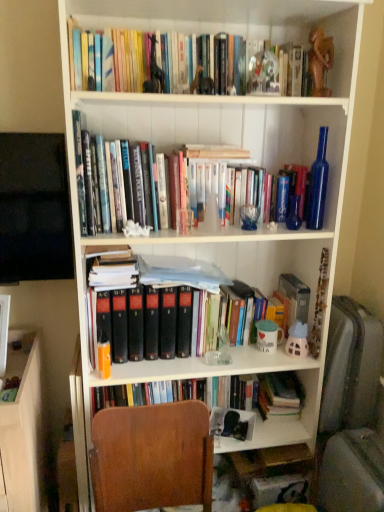
I want to click on brown wood chair at lower center, so click(152, 457).

Find the location of a particular element. The width and height of the screenshot is (384, 512). hardcover book at center is located at coordinates (295, 298).

Measure the distance between hardcover book at center and camera.

hardcover book at center is 1.74 meters away from camera.

What is the approximate height of white glossy mug at middle right?

5.28 inches.

The width and height of the screenshot is (384, 512). What do you see at coordinates (268, 335) in the screenshot?
I see `white glossy mug at middle right` at bounding box center [268, 335].

Identify the location of brown wood chair at lower center. (152, 457).

From the image's perspective, which is above, hardcover books at lower center, arranged as the first book when viewed from the back, or hardcover book at center?

hardcover book at center is shown above in the image.

Based on their positions, is hardcover books at lower center, arranged as the 2th book when viewed from the front, located to the left or right of hardcover book at center?

From the image, it's evident that hardcover books at lower center, arranged as the 2th book when viewed from the front, is to the left of hardcover book at center.

Can you see hardcover books at lower center, the 1th book when ordered from bottom to top, touching hardcover book at center?

No, hardcover books at lower center, the 1th book when ordered from bottom to top, is not with hardcover book at center.

At what (x,y) coordinates should I click in order to perform the action: click on chair in front of the hardcover books at upper center, acting as the first book starting from the front. Please return your answer as a coordinate pair (x, y). Image resolution: width=384 pixels, height=512 pixels. Looking at the image, I should click on (152, 457).

Consider the image. From a real-world perspective, between brown wood chair at lower center and hardcover books at upper center, placed as the first book when sorted from top to bottom, who is vertically higher?

In real-world perspective, hardcover books at upper center, placed as the first book when sorted from top to bottom, is above.

Would you say brown wood chair at lower center is outside hardcover books at upper center, acting as the first book starting from the front?

Indeed, brown wood chair at lower center is completely outside hardcover books at upper center, acting as the first book starting from the front.

Looking at this image, is hardcover books at upper center, placed as the first book when sorted from top to bottom, oriented towards hardcover book at center?

No.

Is hardcover books at upper center, which is counted as the 2th book, starting from the bottom, to the right of hardcover book at center from the viewer's perspective?

Incorrect, hardcover books at upper center, which is counted as the 2th book, starting from the bottom, is not on the right side of hardcover book at center.

From a real-world perspective, is hardcover books at upper center, which is counted as the 2th book, starting from the bottom, under hardcover book at center?

No, from a real-world perspective, hardcover books at upper center, which is counted as the 2th book, starting from the bottom, is not below hardcover book at center.

Relative to hardcover book at center, is hardcover books at upper center, acting as the first book starting from the front, in front or behind?

hardcover books at upper center, acting as the first book starting from the front, is in front of hardcover book at center.

Between white glossy mug at middle right and hardcover book at center, which one is positioned in front?

white glossy mug at middle right is in front.

Where is `coffee cup that is below the hardcover book at center (from the image's perspective)`? This screenshot has width=384, height=512. coffee cup that is below the hardcover book at center (from the image's perspective) is located at coordinates (268, 335).

Would you say white glossy mug at middle right is inside or outside hardcover book at center?

white glossy mug at middle right is not inside hardcover book at center, it's outside.

Can you see white glossy mug at middle right touching hardcover book at center?

white glossy mug at middle right is not next to hardcover book at center, and they're not touching.

From a real-world perspective, is hardcover book at center physically below hardcover books at upper center, which ranks as the 2th book in back-to-front order?

Yes.

Is hardcover book at center bigger than hardcover books at upper center, placed as the first book when sorted from top to bottom?

Incorrect, hardcover book at center is not larger than hardcover books at upper center, placed as the first book when sorted from top to bottom.

From the image's perspective, which is below, hardcover book at center or hardcover books at upper center, acting as the first book starting from the front?

hardcover book at center appears lower in the image.

From the image's perspective, is hardcover books at lower center, the 1th book when ordered from bottom to top, below hardcover books at upper center, acting as the first book starting from the front?

Yes.

Between hardcover books at lower center, arranged as the first book when viewed from the back, and hardcover books at upper center, which is counted as the 2th book, starting from the bottom, which one has more height?

With more height is hardcover books at lower center, arranged as the first book when viewed from the back.

This screenshot has width=384, height=512. Find the location of `book beneath the hardcover books at upper center, which ranks as the 2th book in back-to-front order (from a real-world perspective)`. book beneath the hardcover books at upper center, which ranks as the 2th book in back-to-front order (from a real-world perspective) is located at coordinates (279, 395).

Which object is positioned more to the right, hardcover books at lower center, arranged as the first book when viewed from the back, or hardcover books at upper center, acting as the first book starting from the front?

hardcover books at lower center, arranged as the first book when viewed from the back, is more to the right.

Is hardcover books at upper center, acting as the first book starting from the front, oriented towards hardcover books at lower center, arranged as the first book when viewed from the back?

No, hardcover books at upper center, acting as the first book starting from the front, is not facing towards hardcover books at lower center, arranged as the first book when viewed from the back.

From a real-world perspective, is hardcover books at upper center, which is counted as the 2th book, starting from the bottom, positioned above or below hardcover books at lower center, the 2th book when ordered from top to bottom?

From a real-world perspective, hardcover books at upper center, which is counted as the 2th book, starting from the bottom, is physically above hardcover books at lower center, the 2th book when ordered from top to bottom.

From their relative heights in the image, would you say hardcover books at upper center, which ranks as the 2th book in back-to-front order, is taller or shorter than hardcover books at lower center, the 2th book when ordered from top to bottom?

In the image, hardcover books at upper center, which ranks as the 2th book in back-to-front order, appears to be shorter than hardcover books at lower center, the 2th book when ordered from top to bottom.

Consider the image. Who is bigger, hardcover books at upper center, which ranks as the 2th book in back-to-front order, or hardcover books at lower center, the 1th book when ordered from bottom to top?

hardcover books at upper center, which ranks as the 2th book in back-to-front order, is bigger.

Locate an element on the screen. book behind the hardcover book at center is located at coordinates (279, 395).

Starting from the brown wood chair at lower center, which book is the 1st one to the right? Please provide its 2D coordinates.

[(155, 61)]

Estimate the real-world distances between objects in this image. Which object is further from hardcover books at upper center, which ranks as the 2th book in back-to-front order, hardcover book at center or hardcover books at lower center, arranged as the first book when viewed from the back?

Among the two, hardcover books at lower center, arranged as the first book when viewed from the back, is located further to hardcover books at upper center, which ranks as the 2th book in back-to-front order.

From the picture: Based on their spatial positions, is brown wood chair at lower center or hardcover book at center further from white glossy mug at middle right?

brown wood chair at lower center is positioned further to the anchor white glossy mug at middle right.

Which object lies nearer to the anchor point hardcover books at lower center, arranged as the first book when viewed from the back, white glossy mug at middle right or brown wood chair at lower center?

Based on the image, white glossy mug at middle right appears to be nearer to hardcover books at lower center, arranged as the first book when viewed from the back.

Looking at the image, which one is located closer to hardcover books at upper center, placed as the first book when sorted from top to bottom, hardcover books at lower center, the 2th book when ordered from top to bottom, or brown wood chair at lower center?

brown wood chair at lower center is positioned closer to the anchor hardcover books at upper center, placed as the first book when sorted from top to bottom.

Looking at the image, which one is located closer to hardcover books at lower center, the 2th book when ordered from top to bottom, brown wood chair at lower center or white glossy mug at middle right?

white glossy mug at middle right.

From the image, which object appears to be farther from hardcover book at center, brown wood chair at lower center or hardcover books at lower center, arranged as the 2th book when viewed from the front?

Based on the image, brown wood chair at lower center appears to be further to hardcover book at center.

Based on the photo, based on their spatial positions, is white glossy mug at middle right or hardcover books at upper center, which ranks as the 2th book in back-to-front order, further from brown wood chair at lower center?

Among the two, hardcover books at upper center, which ranks as the 2th book in back-to-front order, is located further to brown wood chair at lower center.

Looking at this image, looking at the image, which one is located further to hardcover books at lower center, arranged as the 2th book when viewed from the front, hardcover book at center or brown wood chair at lower center?

brown wood chair at lower center.

The image size is (384, 512). I want to click on coffee cup between hardcover book at center and hardcover books at lower center, the 1th book when ordered from bottom to top, from top to bottom, so click(x=268, y=335).

This screenshot has height=512, width=384. Find the location of `coffee cup between brown wood chair at lower center and hardcover books at lower center, arranged as the 2th book when viewed from the front, from front to back`. coffee cup between brown wood chair at lower center and hardcover books at lower center, arranged as the 2th book when viewed from the front, from front to back is located at coordinates (268, 335).

Locate an element on the screen. The image size is (384, 512). book between hardcover books at upper center, placed as the first book when sorted from top to bottom, and brown wood chair at lower center, in the vertical direction is located at coordinates (279, 395).

The image size is (384, 512). I want to click on paperback book between brown wood chair at lower center and hardcover books at lower center, arranged as the first book when viewed from the back, in the front-back direction, so click(295, 298).